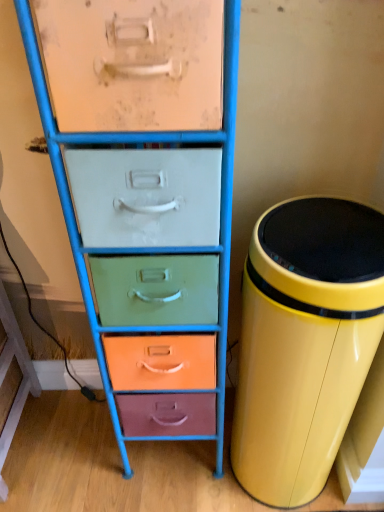
Question: Considering the relative sizes of yellow glossy trash can at right and metallic drawer unit at center in the image provided, is yellow glossy trash can at right smaller than metallic drawer unit at center?

Choices:
 (A) no
 (B) yes

Answer: (B)

Question: Can you confirm if yellow glossy trash can at right is wider than metallic drawer unit at center?

Choices:
 (A) no
 (B) yes

Answer: (B)

Question: Can you confirm if yellow glossy trash can at right is shorter than metallic drawer unit at center?

Choices:
 (A) no
 (B) yes

Answer: (B)

Question: Is yellow glossy trash can at right oriented towards metallic drawer unit at center?

Choices:
 (A) no
 (B) yes

Answer: (A)

Question: Does yellow glossy trash can at right lie in front of metallic drawer unit at center?

Choices:
 (A) no
 (B) yes

Answer: (A)

Question: From a real-world perspective, is yellow glossy trash can at right below metallic drawer unit at center?

Choices:
 (A) no
 (B) yes

Answer: (B)

Question: From the image's perspective, is metallic drawer unit at center located above yellow glossy trash can at right?

Choices:
 (A) no
 (B) yes

Answer: (B)

Question: Could you tell me if metallic drawer unit at center is facing yellow glossy trash can at right?

Choices:
 (A) no
 (B) yes

Answer: (A)

Question: Is metallic drawer unit at center far away from yellow glossy trash can at right?

Choices:
 (A) no
 (B) yes

Answer: (A)

Question: Is metallic drawer unit at center directly adjacent to yellow glossy trash can at right?

Choices:
 (A) yes
 (B) no

Answer: (B)

Question: Is metallic drawer unit at center wider than yellow glossy trash can at right?

Choices:
 (A) no
 (B) yes

Answer: (A)

Question: Does metallic drawer unit at center have a larger size compared to yellow glossy trash can at right?

Choices:
 (A) no
 (B) yes

Answer: (B)

Question: Is metallic drawer unit at center situated inside yellow glossy trash can at right or outside?

Choices:
 (A) outside
 (B) inside

Answer: (A)